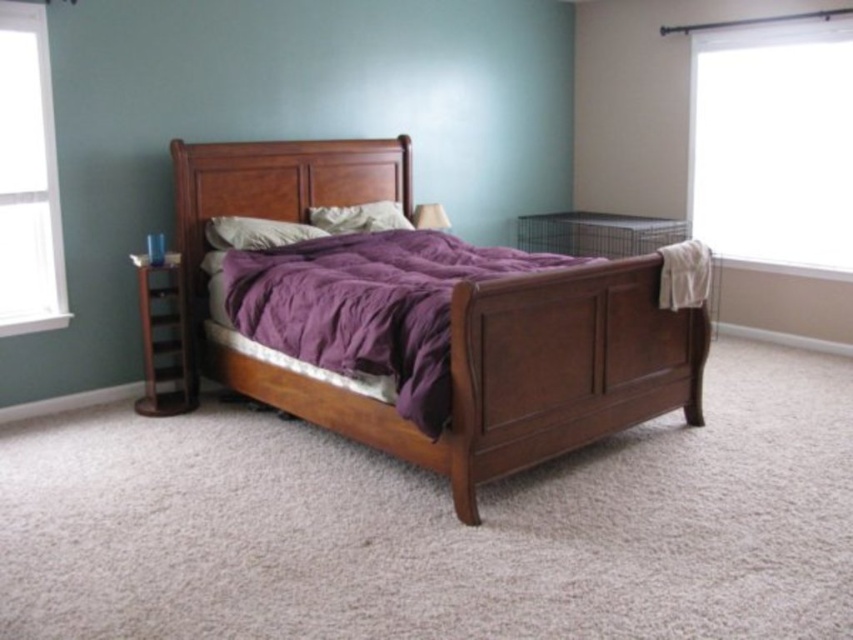
Is point (517, 381) positioned after point (314, 205)?

No, it is not.

Find the location of a particular element. Image resolution: width=853 pixels, height=640 pixels. matte wood bed at center is located at coordinates (454, 324).

Does white sheer curtain at upper right have a lesser height compared to purple cotton blanket at center?

No.

Is point (805, 188) positioned after point (366, 291)?

Yes, point (805, 188) is behind point (366, 291).

Between point (699, 33) and point (404, 236), which one is positioned in front?

Point (404, 236)

The width and height of the screenshot is (853, 640). I want to click on white sheer curtain at upper right, so click(x=773, y=144).

Does white glass window at left have a greater height compared to matte purple pillow at upper center?

Yes.

How distant is white glass window at left from matte purple pillow at upper center?

They are 3.51 feet apart.

Is point (39, 100) more distant than point (277, 241)?

That is False.

The width and height of the screenshot is (853, 640). What are the coordinates of `white glass window at left` in the screenshot? It's located at (28, 179).